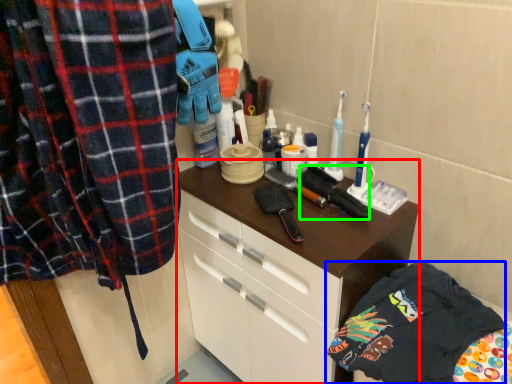
Question: Which object is positioned closest to cabinetry (highlighted by a red box)? Select from clothing (highlighted by a blue box) and brush (highlighted by a green box).

Choices:
 (A) clothing
 (B) brush

Answer: (A)